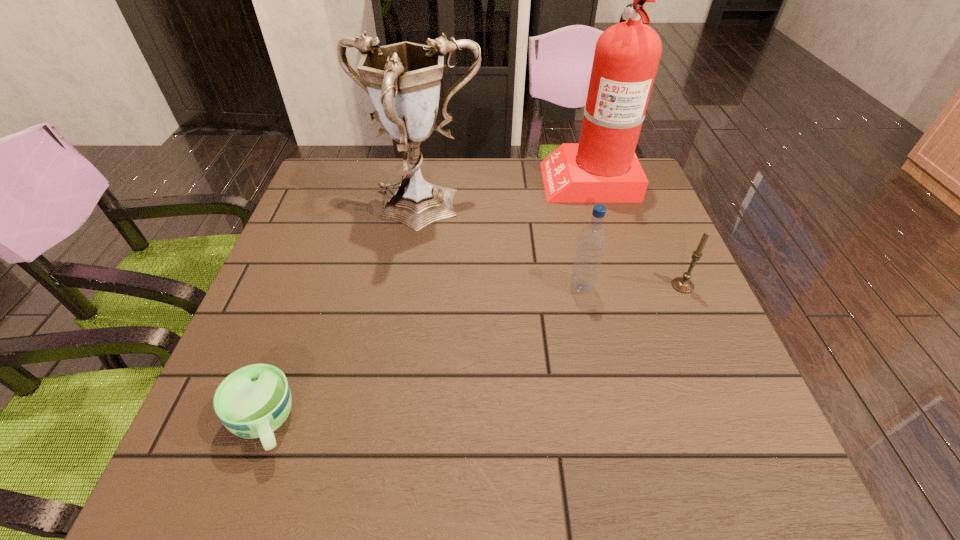
Find the location of a particular element. vacant space situated 0.240m on the left of the water bottle is located at coordinates (461, 287).

Identify the location of vacant space situated on the front of the candle. Image resolution: width=960 pixels, height=540 pixels. (704, 334).

At what (x,y) coordinates should I click in order to perform the action: click on vacant space situated on the right of the cup. Please return your answer as a coordinate pair (x, y). The image size is (960, 540). Looking at the image, I should click on (489, 423).

Locate an element on the screen. The height and width of the screenshot is (540, 960). fire extinguisher positioned at the far edge is located at coordinates (602, 168).

This screenshot has height=540, width=960. I want to click on trophy cup positioned at the far edge, so click(403, 80).

Locate an element on the screen. This screenshot has width=960, height=540. object that is at the near edge is located at coordinates (252, 402).

Locate an element on the screen. This screenshot has width=960, height=540. trophy cup that is at the left edge is located at coordinates (403, 80).

The image size is (960, 540). Identify the location of cup that is at the left edge. [x=252, y=402].

Find the location of `fire extinguisher at the right edge`. fire extinguisher at the right edge is located at coordinates (602, 168).

Find the location of a particular element. This screenshot has width=960, height=540. candle that is at the right edge is located at coordinates (682, 284).